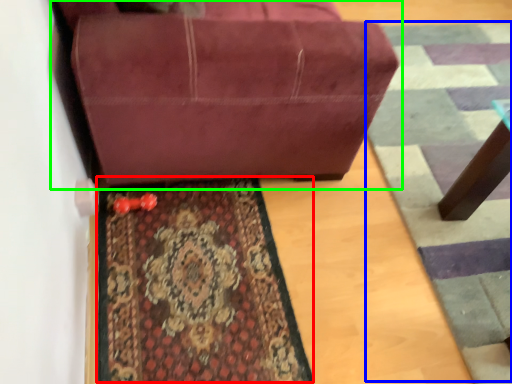
Question: Estimate the real-world distances between objects in this image. Which object is farther from mat (highlighted by a red box), doormat (highlighted by a blue box) or studio couch (highlighted by a green box)?

Choices:
 (A) doormat
 (B) studio couch

Answer: (A)